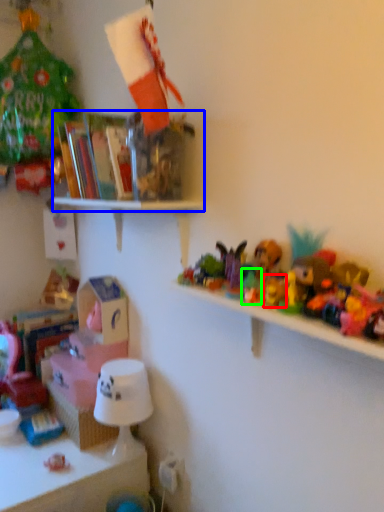
Question: Based on their relative distances, which object is nearer to toy (highlighted by a red box)? Choose from shelf (highlighted by a blue box) and toy (highlighted by a green box).

Choices:
 (A) shelf
 (B) toy

Answer: (B)